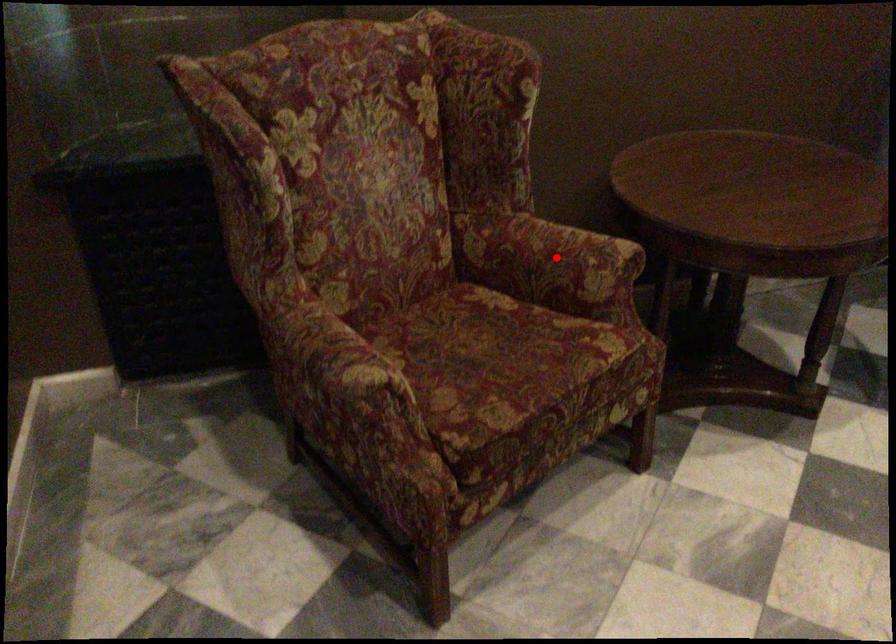
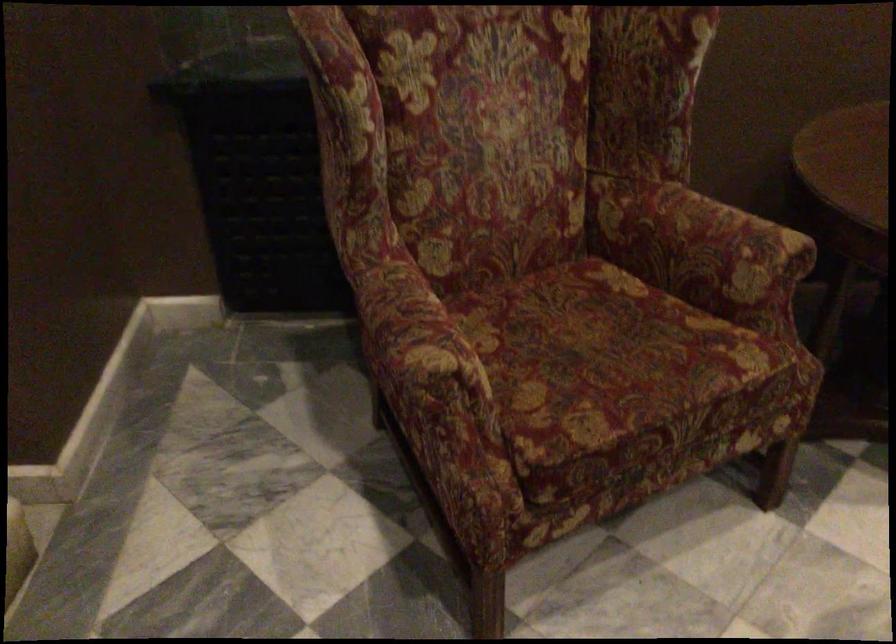
In the second image, find the point that corresponds to the highlighted location in the first image.

(700, 243)